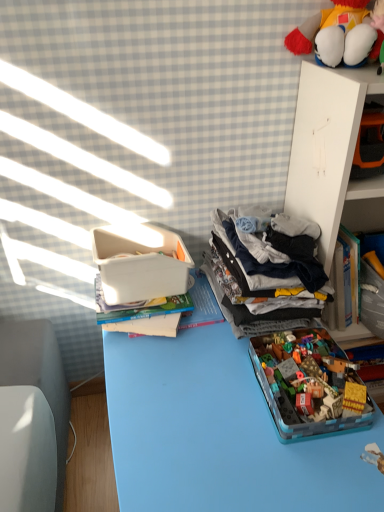
Question: Is fluffy plush toy at upper right, which ranks as the second toy in bottom-to-top order, taller or shorter than white plastic container at upper left?

Choices:
 (A) tall
 (B) short

Answer: (B)

Question: Considering the positions of point (380, 10) and point (198, 280), is point (380, 10) closer or farther from the camera than point (198, 280)?

Choices:
 (A) farther
 (B) closer

Answer: (B)

Question: Which object is positioned closest to the white plastic container at upper left?

Choices:
 (A) white cardboard at upper right
 (B) dark gray cotton clothes at center right
 (C) fluffy plush toy at upper right, which ranks as the second toy in bottom-to-top order
 (D) white plastic container at upper left
 (E) translucent plastic container at center, which is the second toy in top-to-bottom order

Answer: (D)

Question: Which is nearer to the fluffy plush toy at upper right, which ranks as the second toy in bottom-to-top order?

Choices:
 (A) white plastic container at upper left
 (B) white plastic container at upper left
 (C) dark gray cotton clothes at center right
 (D) translucent plastic container at center, which is the second toy in top-to-bottom order
 (E) white cardboard at upper right

Answer: (E)